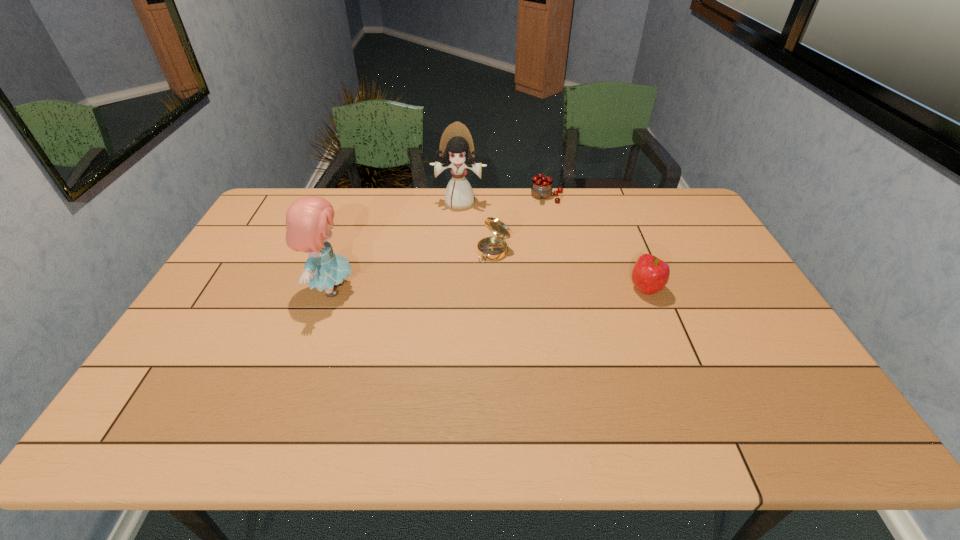
At what (x,y) coordinates should I click in order to perform the action: click on blank space at the near edge. Please return your answer as a coordinate pair (x, y). Image resolution: width=960 pixels, height=540 pixels. Looking at the image, I should click on (261, 391).

In the image, there is a desktop. Identify the location of vacant space at the left edge. This screenshot has width=960, height=540. pos(196,309).

Locate an element on the screen. The width and height of the screenshot is (960, 540). vacant space at the right edge is located at coordinates click(732, 328).

Where is `vacant space at the far left corner`? This screenshot has height=540, width=960. vacant space at the far left corner is located at coordinates (282, 188).

You are a GUI agent. You are given a task and a screenshot of the screen. Output one action in this format:
    pyautogui.click(x=<x>, y=<y>)
    Task: Click on the vacant region between the right doll and the apple
    The width and height of the screenshot is (960, 540).
    Given the screenshot: What is the action you would take?
    pyautogui.click(x=553, y=246)

Where is `empty space between the right doll and the compass`? empty space between the right doll and the compass is located at coordinates (477, 227).

Identify the location of free space that is in between the right doll and the compass. (477, 227).

Where is `vacant area that lies between the leftmost object and the compass`? The image size is (960, 540). vacant area that lies between the leftmost object and the compass is located at coordinates (413, 271).

You are a GUI agent. You are given a task and a screenshot of the screen. Output one action in this format:
    pyautogui.click(x=<x>, y=<y>)
    Task: Click on the vacant space in between the pot filled with cherries and the compass
    This screenshot has width=960, height=540.
    Given the screenshot: What is the action you would take?
    pyautogui.click(x=520, y=224)

Image resolution: width=960 pixels, height=540 pixels. What are the coordinates of `free space between the apple and the right doll` in the screenshot? It's located at (553, 246).